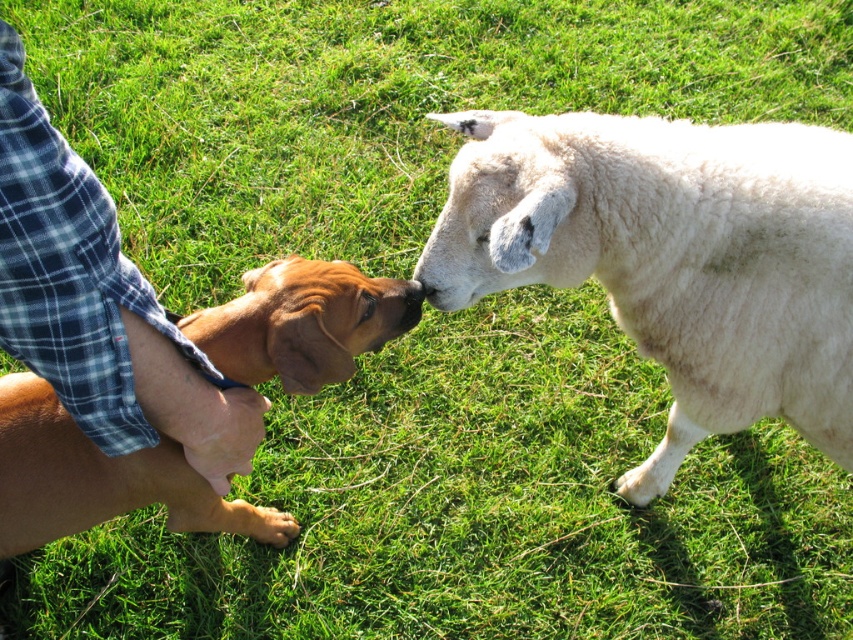
What is located at the coordinates point (99, 480) in the image?

The point (99, 480) corresponds to the brown furry dog at left.

In the scene shown: You are a photographer trying to capture a closeup of the brown furry dog at left and the black smooth nose at center. If your camera can focus on objects within a 40 cm range, will you be able to get both in focus?

The brown furry dog at left and the black smooth nose at center are 45.04 centimeters apart, so the camera cannot focus on both since the distance exceeds the 40 cm range.

You are standing in the scene and want to locate the blue plaid shirt at lower left. What are the coordinates where you can find it?

The blue plaid shirt at lower left can be found at coordinates point (99, 304).